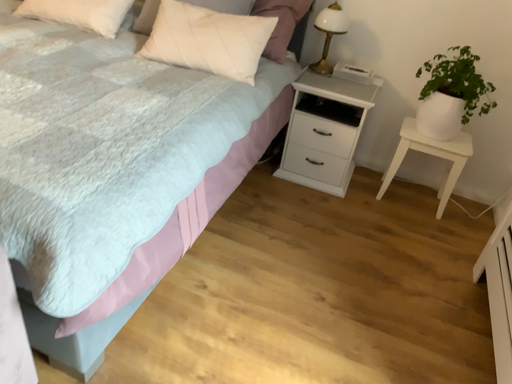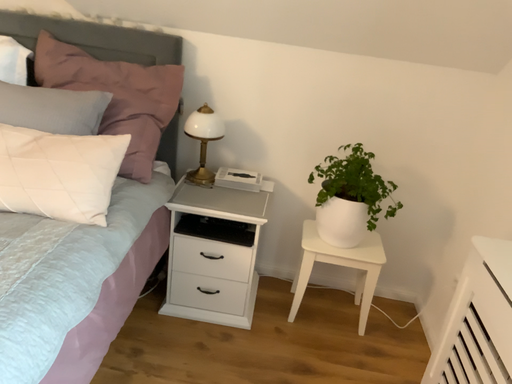
Question: Which way did the camera rotate in the video?

Choices:
 (A) rotated left
 (B) rotated right

Answer: (B)